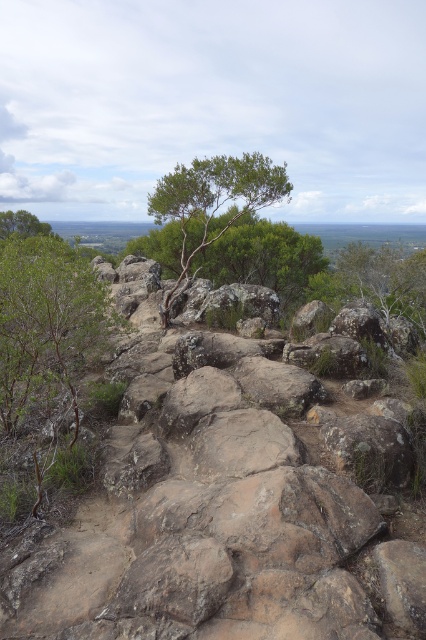
Is the position of rusty stone boulder at center more distant than that of green leafy tree at upper left?

No.

Is rusty stone boulder at center to the left of green leafy tree at upper left from the viewer's perspective?

No, rusty stone boulder at center is not to the left of green leafy tree at upper left.

Who is more distant from viewer, [382,632] or [37,218]?

The point [37,218] is behind.

Locate an element on the screen. rusty stone boulder at center is located at coordinates (221, 500).

Is rusty stone boulder at center below green leafy tree at center?

Indeed, rusty stone boulder at center is positioned under green leafy tree at center.

Who is positioned more to the right, rusty stone boulder at center or green leafy tree at center?

rusty stone boulder at center is more to the right.

Locate an element on the screen. The image size is (426, 640). rusty stone boulder at center is located at coordinates (221, 500).

Is green leafy tree at center bigger than green leafy tree at upper left?

Indeed, green leafy tree at center has a larger size compared to green leafy tree at upper left.

Where is `green leafy tree at center`? Image resolution: width=426 pixels, height=640 pixels. green leafy tree at center is located at coordinates (213, 204).

Between point (261, 163) and point (8, 216), which one is positioned in front?

Positioned in front is point (261, 163).

Where is `green leafy tree at center`? This screenshot has width=426, height=640. green leafy tree at center is located at coordinates (213, 204).